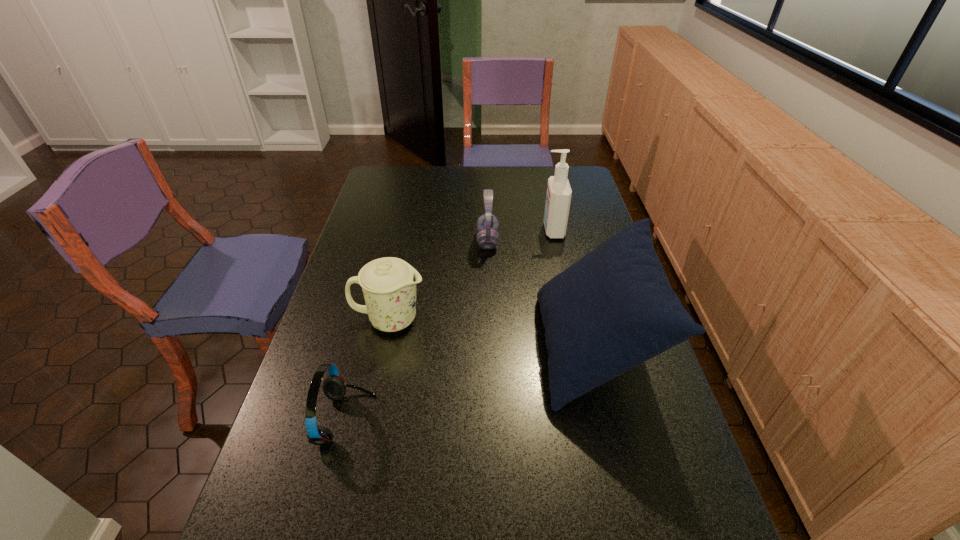
This screenshot has width=960, height=540. Find the location of `cleansing agent at the right edge`. cleansing agent at the right edge is located at coordinates (558, 198).

In order to click on cushion that is at the right edge in this screenshot , I will do `click(612, 310)`.

Find the location of a particular element. The height and width of the screenshot is (540, 960). free location at the far edge of the desktop is located at coordinates (432, 171).

Locate an element on the screen. The width and height of the screenshot is (960, 540). vacant area at the left edge of the desktop is located at coordinates (323, 345).

In the image, there is a desktop. Where is `vacant space at the right edge`? Image resolution: width=960 pixels, height=540 pixels. vacant space at the right edge is located at coordinates (572, 232).

In the image, there is a desktop. At what (x,y) coordinates should I click in order to perform the action: click on vacant space at the far left corner. Please return your answer as a coordinate pair (x, y). The image size is (960, 540). Looking at the image, I should click on (405, 185).

This screenshot has height=540, width=960. What are the coordinates of `unoccupied area between the chinaware and the left headset` in the screenshot? It's located at (368, 370).

Identify the location of empty location between the nearer headset and the right headset. (417, 330).

Identify the location of vacant region between the cleansing agent and the shorter headset. This screenshot has width=960, height=540. (449, 325).

You are a GUI agent. You are given a task and a screenshot of the screen. Output one action in this format:
    pyautogui.click(x=<x>, y=<y>)
    Task: Click on the free area in between the right headset and the chinaware
    
    Given the screenshot: What is the action you would take?
    pyautogui.click(x=439, y=280)